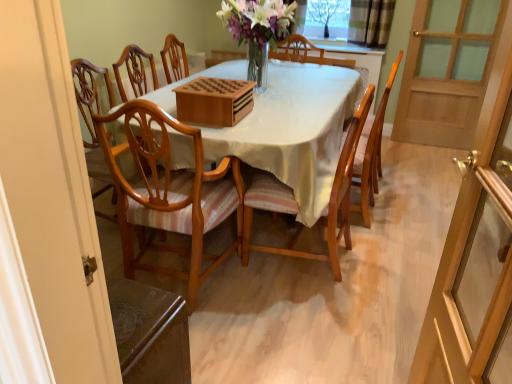
Question: From the image's perspective, is transparent glass screen door at right, which appears as the second screen door when viewed from the back, below wooden screen door at right, positioned as the 2th screen door in left-to-right order?

Choices:
 (A) no
 (B) yes

Answer: (B)

Question: Is transparent glass screen door at right, the second screen door in the right-to-left sequence, smaller than wooden screen door at right, which ranks as the first screen door in back-to-front order?

Choices:
 (A) yes
 (B) no

Answer: (A)

Question: Can you confirm if transparent glass screen door at right, the second screen door in the right-to-left sequence, is positioned to the left of wooden screen door at right, marked as the 2th screen door in a front-to-back arrangement?

Choices:
 (A) yes
 (B) no

Answer: (A)

Question: Is transparent glass screen door at right, which appears as the second screen door when viewed from the back, at the right side of wooden screen door at right, the first screen door from the top?

Choices:
 (A) yes
 (B) no

Answer: (B)

Question: Is transparent glass screen door at right, which is counted as the second screen door, starting from the top, positioned beyond the bounds of wooden screen door at right, marked as the 2th screen door in a front-to-back arrangement?

Choices:
 (A) yes
 (B) no

Answer: (A)

Question: Considering the positions of point (260, 182) and point (94, 192), is point (260, 182) closer or farther from the camera than point (94, 192)?

Choices:
 (A) closer
 (B) farther

Answer: (A)

Question: Is wooden chair with striped cushion at center, the second chair viewed from the right, wider or thinner than wooden table at center?

Choices:
 (A) wide
 (B) thin

Answer: (B)

Question: In terms of size, does wooden chair with striped cushion at center, the 2th chair viewed from the left, appear bigger or smaller than wooden table at center?

Choices:
 (A) small
 (B) big

Answer: (A)

Question: In the image, is wooden chair with striped cushion at center, the 2th chair viewed from the left, positioned in front of or behind wooden table at center?

Choices:
 (A) behind
 (B) front

Answer: (B)

Question: Does point (480, 215) appear closer or farther from the camera than point (121, 165)?

Choices:
 (A) closer
 (B) farther

Answer: (A)

Question: In the image, is transparent glass screen door at right, arranged as the 1th screen door when viewed from the left, positioned in front of or behind wooden table at center?

Choices:
 (A) behind
 (B) front

Answer: (B)

Question: Is transparent glass screen door at right, which appears as the second screen door when viewed from the back, inside the boundaries of wooden table at center, or outside?

Choices:
 (A) inside
 (B) outside

Answer: (B)

Question: From a real-world perspective, is transparent glass screen door at right, which appears as the second screen door when viewed from the back, above or below wooden table at center?

Choices:
 (A) below
 (B) above

Answer: (B)

Question: From a real-world perspective, relative to transparent glass screen door at right, arranged as the 1th screen door when viewed from the left, is transparent glass tree at upper center vertically above or below?

Choices:
 (A) below
 (B) above

Answer: (B)

Question: Is point (323, 8) closer or farther from the camera than point (483, 187)?

Choices:
 (A) farther
 (B) closer

Answer: (A)